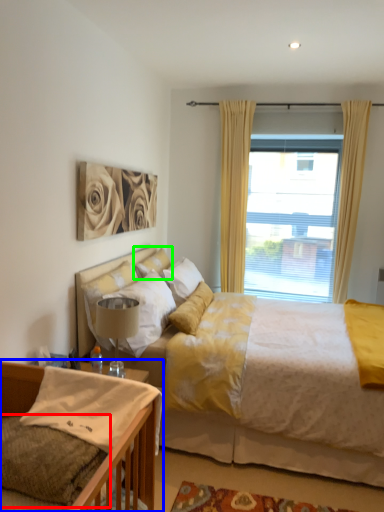
Question: Which object is the farthest from pillow (highlighted by a red box)? Choose among these: bed (highlighted by a blue box) or pillow (highlighted by a green box).

Choices:
 (A) bed
 (B) pillow

Answer: (B)